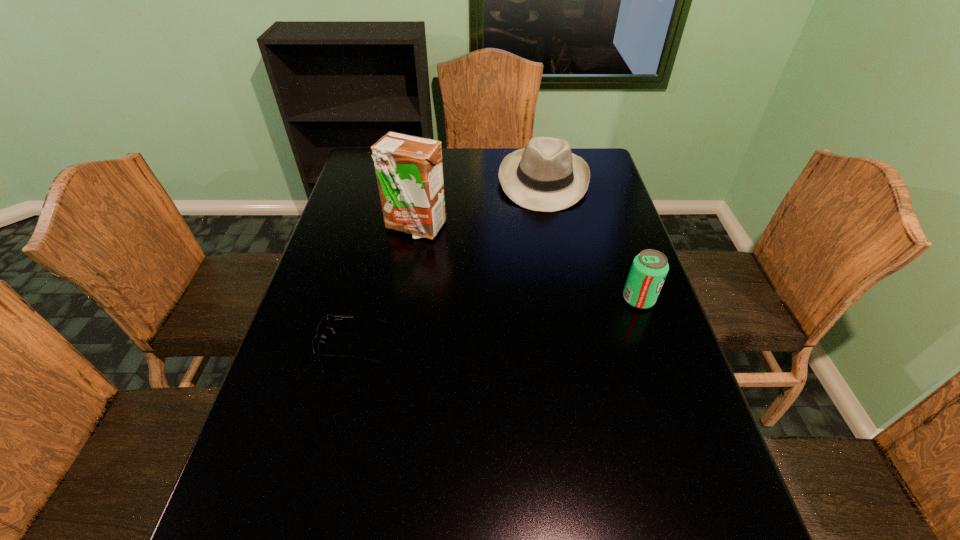
Find the location of `free space between the nearest object and the pop soda`. free space between the nearest object and the pop soda is located at coordinates (495, 321).

I want to click on the second closest object to the sunglasses, so click(x=546, y=176).

Find the location of `the closest object to the fedora`. the closest object to the fedora is located at coordinates (409, 169).

At what (x,y) coordinates should I click in order to perform the action: click on free space that satisfies the following two spatial constraints: 1. on the front side of the fedora; 2. on the front-facing side of the pop soda. Please return your answer as a coordinate pair (x, y). The image size is (960, 540). Looking at the image, I should click on (565, 299).

Find the location of a particular element. vacant position in the image that satisfies the following two spatial constraints: 1. on the front side of the fedora; 2. on the front-facing side of the pop soda is located at coordinates (565, 299).